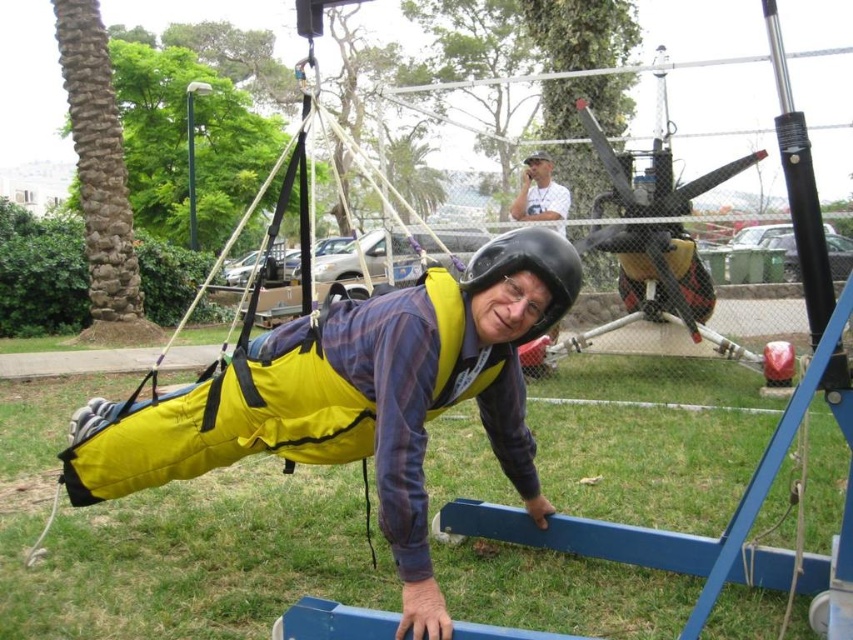
You are standing at the point with coordinates point (576,284) and want to move to the point with coordinates point (503,262). Which direction should you move in to reach your destination?

You should move forward to reach point (503,262) because it is in front of point (576,284).

You are a safety inspector checking the skydiving training setup. You notice the yellow fabric at center and the black matte helmet at center. According to the safety guidelines, the fabric should be positioned to the right of the helmet to ensure proper airflow. Is the current arrangement compliant with the guidelines?

The yellow fabric at center is to the left of the black matte helmet at center, which violates the safety guideline requiring it to be positioned to the right for proper airflow.